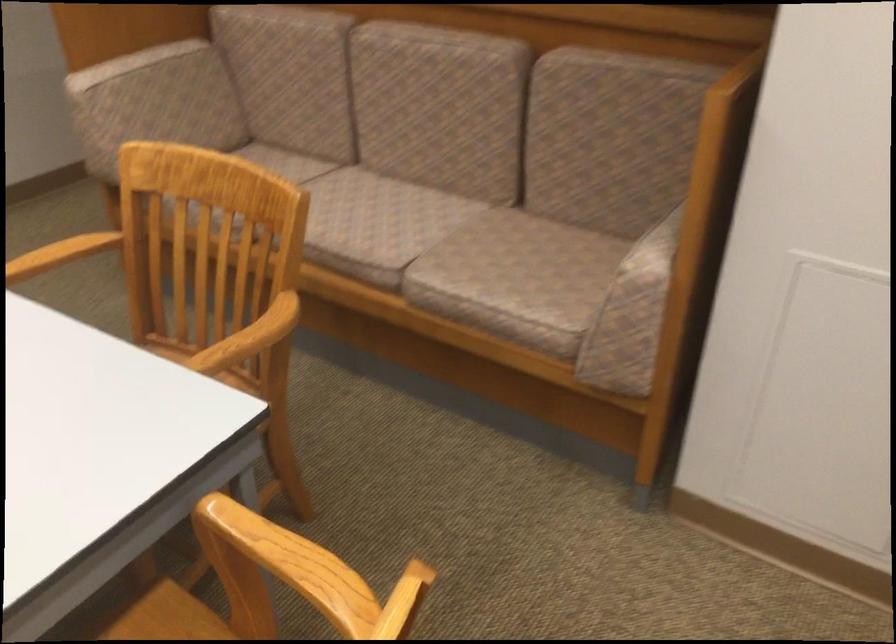
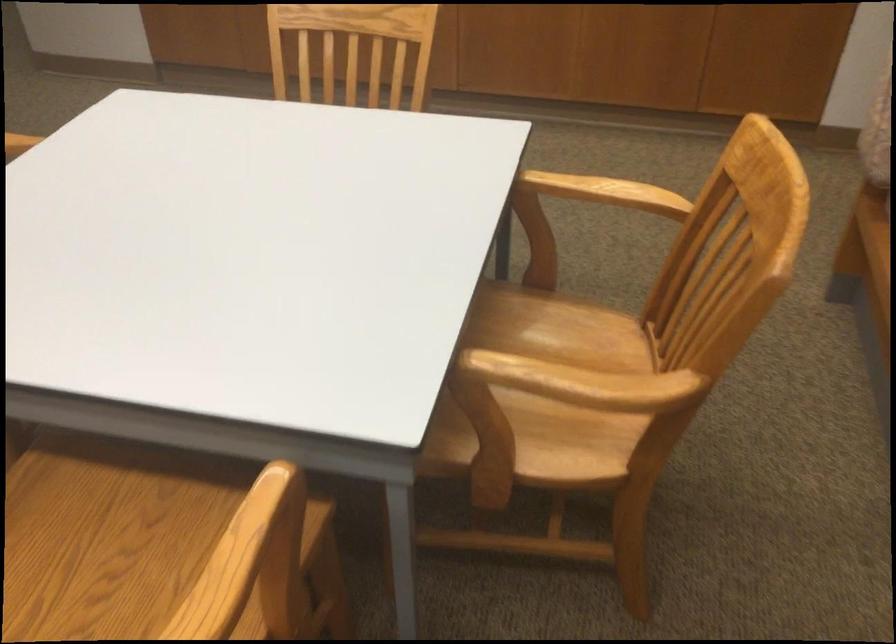
Where in the second image is the point corresponding to [250,337] from the first image?

(583, 383)